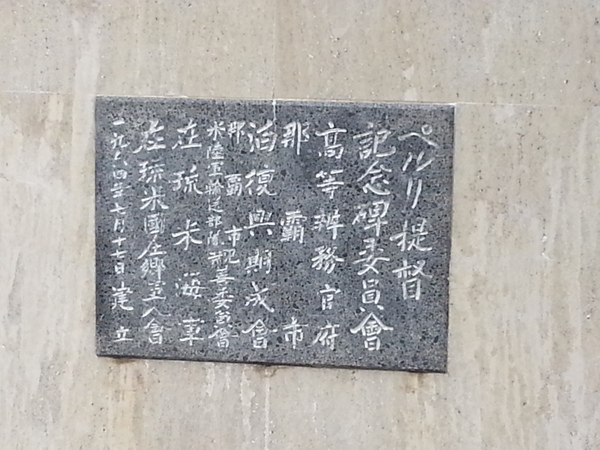
Identify the location of horizontal grout line. The width and height of the screenshot is (600, 450). (510, 110).